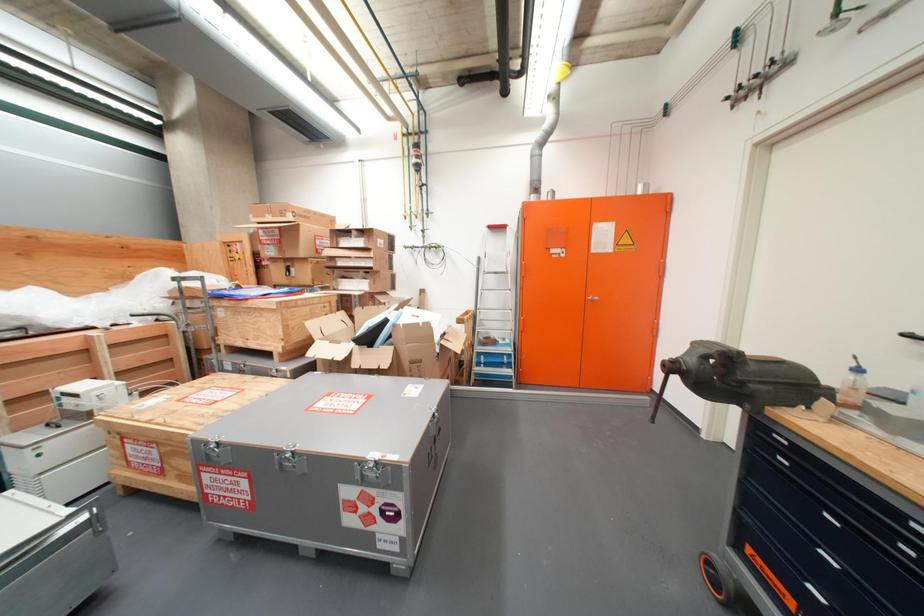
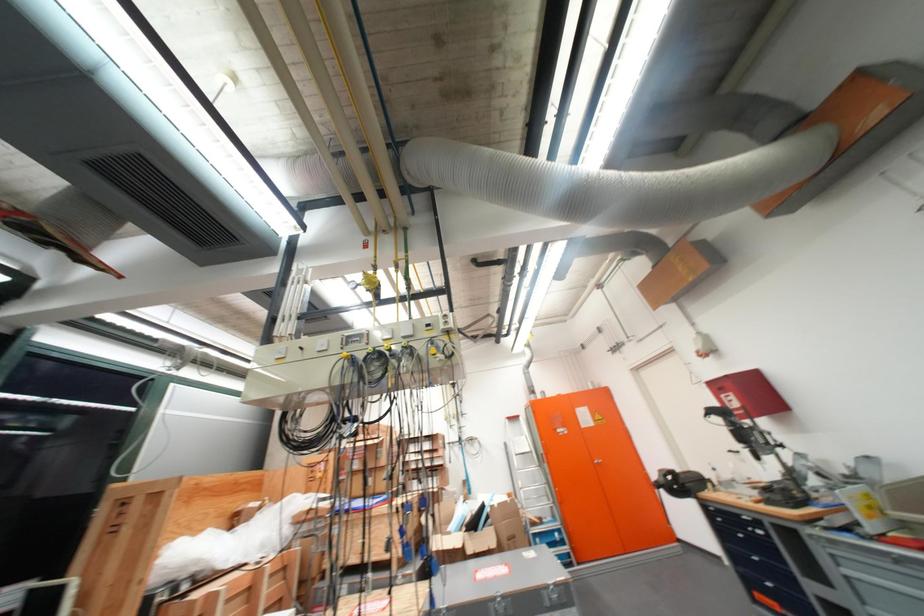
In the second image, find the point that corresponds to the point at 686,369 in the first image.

(670, 487)